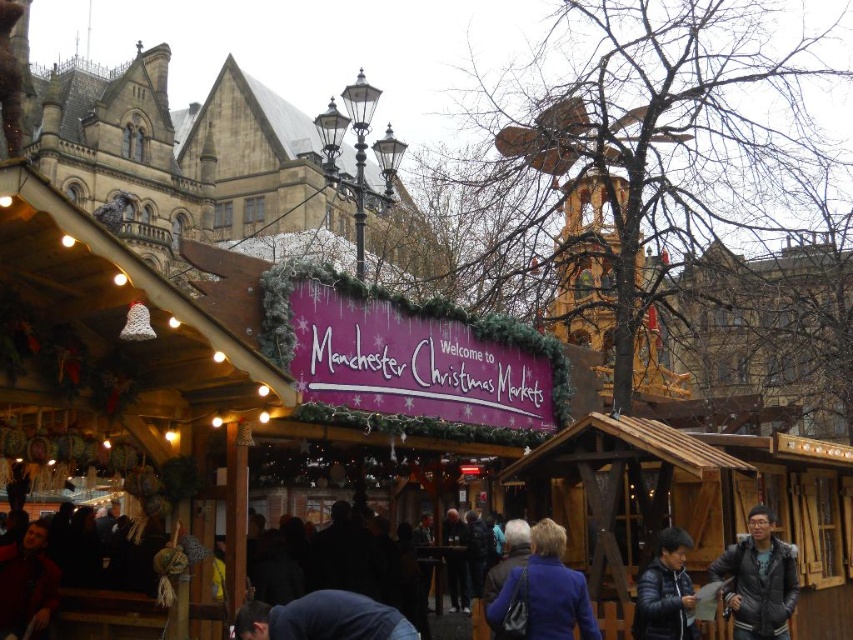
Question: Which object is farther from the camera taking this photo?

Choices:
 (A) blue fabric at lower center
 (B) dark gray puffer jacket at lower right
 (C) matte blue coat at center

Answer: (B)

Question: Is matte blue coat at center wider than black leather jacket at lower center?

Choices:
 (A) no
 (B) yes

Answer: (B)

Question: Is matte blue coat at center to the right of dark brown leather jacket at lower left from the viewer's perspective?

Choices:
 (A) no
 (B) yes

Answer: (B)

Question: Estimate the real-world distances between objects in this image. Which object is farther from the black leather jacket at lower center?

Choices:
 (A) matte blue coat at center
 (B) blue fabric at lower center
 (C) dark brown leather jacket at lower left

Answer: (C)

Question: Does blue fabric at lower center come behind black leather jacket at lower center?

Choices:
 (A) no
 (B) yes

Answer: (A)

Question: Which of the following is the closest to the observer?

Choices:
 (A) (407, 632)
 (B) (22, 620)

Answer: (A)